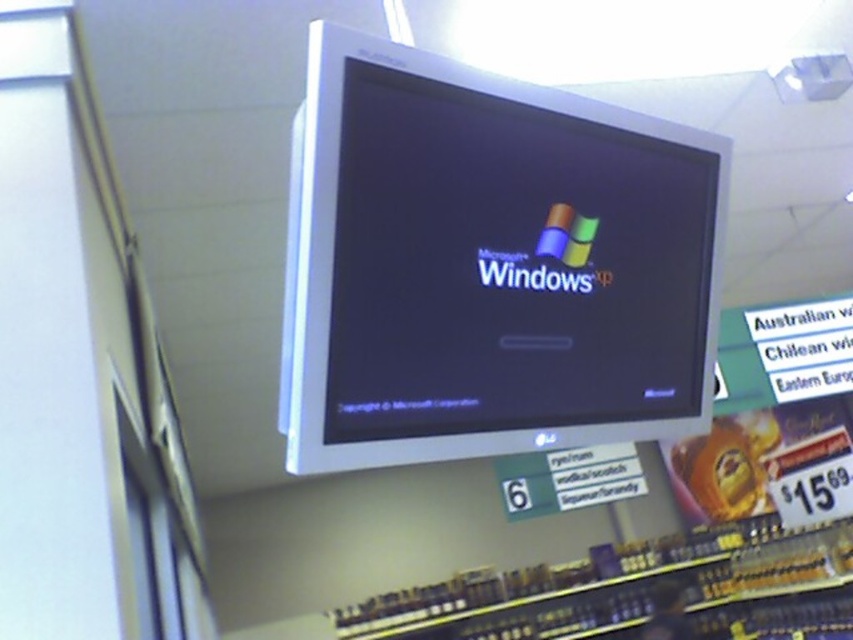
You are setting up a display in a bar and need to arrange the satin silver monitor at center and the metallic silver shelves at lower center. Given their sizes, which object should be placed higher to ensure proper visibility of both items?

The satin silver monitor at center has a smaller size compared to metallic silver shelves at lower center, so placing the smaller monitor higher would allow both items to be visible without obstruction.

Based on the photo, you are standing in front of the CRT monitor with the Windows XP logo. There are two points marked on the monitor screen at coordinates point (347, 104) and point (686, 604). If you were to touch both points with your finger, which point would require your hand to move less distance towards you to reach?

Point (347, 104) is closer to the viewer than point (686, 604), so touching point (347, 104) would require less movement towards you compared to reaching point (686, 604).